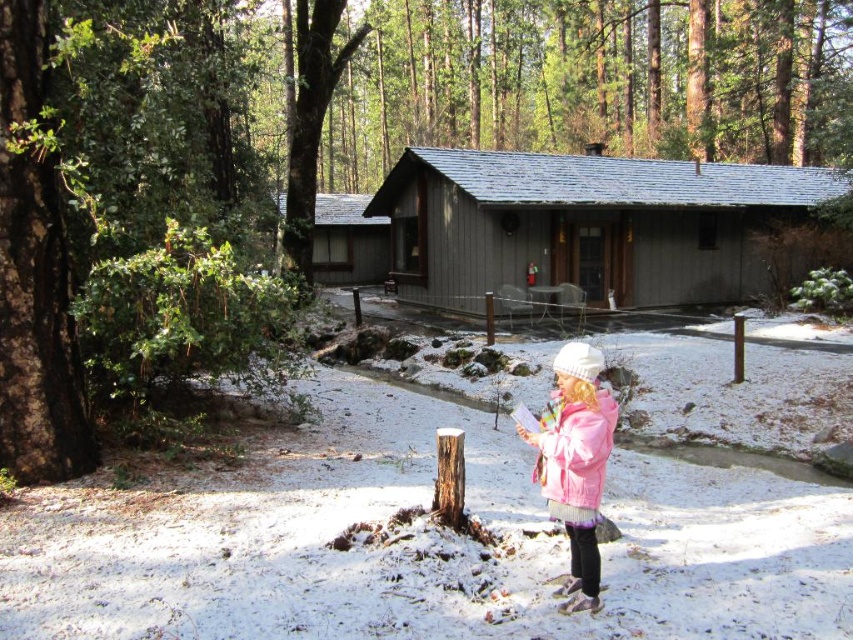
You are standing at the entrance of the rustic cabin and see the pink fleece jacket at lower right. If you walk straight ahead towards the stream, will the jacket be to your left or right?

The pink fleece jacket at lower right is located at point [575,461], which places it to your right side as you face the stream. Therefore, the jacket will be on your right.